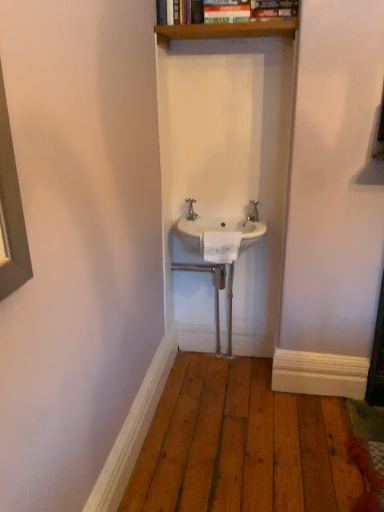
I want to click on vacant space underneath wooden shelf at upper center (from a real-world perspective), so click(230, 219).